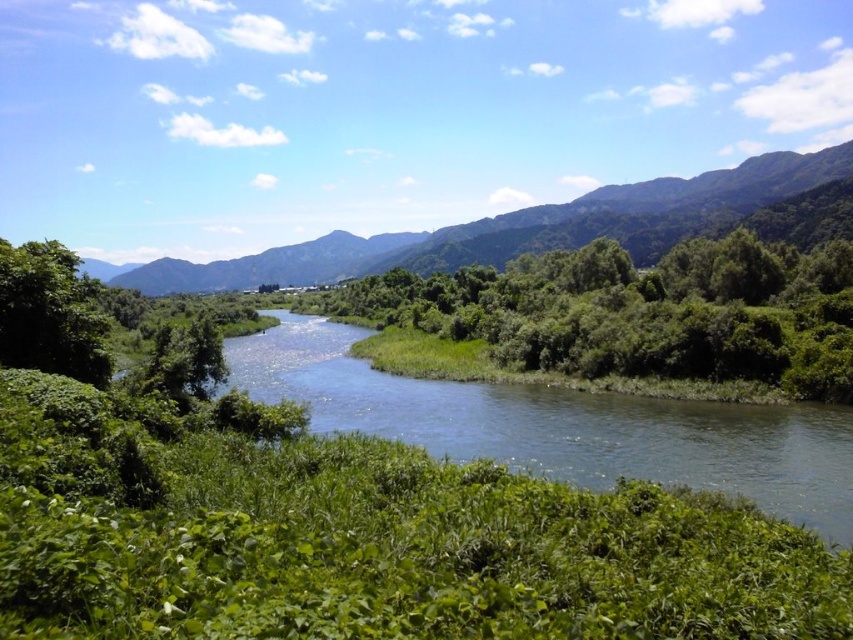
You are a hiker standing at the edge of the river. You notice a green leafy shrub at center and blue smooth water at center. Which object is taller from your viewpoint?

The green leafy shrub at center is taller than the blue smooth water at center.

You are planning to plant a new flower bed in the garden. You have two options for placement based on the image provided. The first option is next to the green leafy shrub at center, and the second is near the green leafy tree at left. Considering their widths, which location would allow for more space around the flower bed?

The green leafy shrub at center might be wider than the green leafy tree at left, so placing the flower bed next to the green leafy shrub at center would likely provide more space due to its potentially greater width.

You are standing at the edge of the flowing river in the image. Looking towards the mountains, there is a point marked at coordinates [517,228]. What does this point indicate in the scene?

The point at [517,228] marks the location of the green leafy mountain at upper center in the scene.